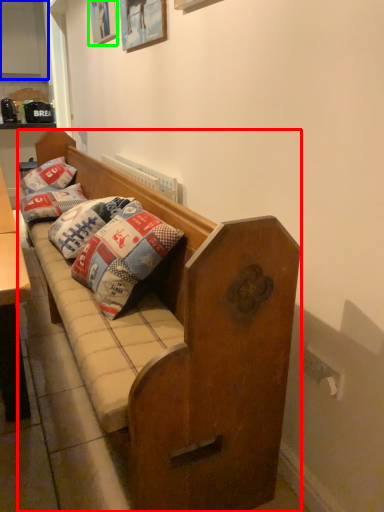
Question: Which object is positioned farthest from studio couch (highlighted by a red box)? Select from cabinetry (highlighted by a blue box) and picture frame (highlighted by a green box).

Choices:
 (A) cabinetry
 (B) picture frame

Answer: (A)